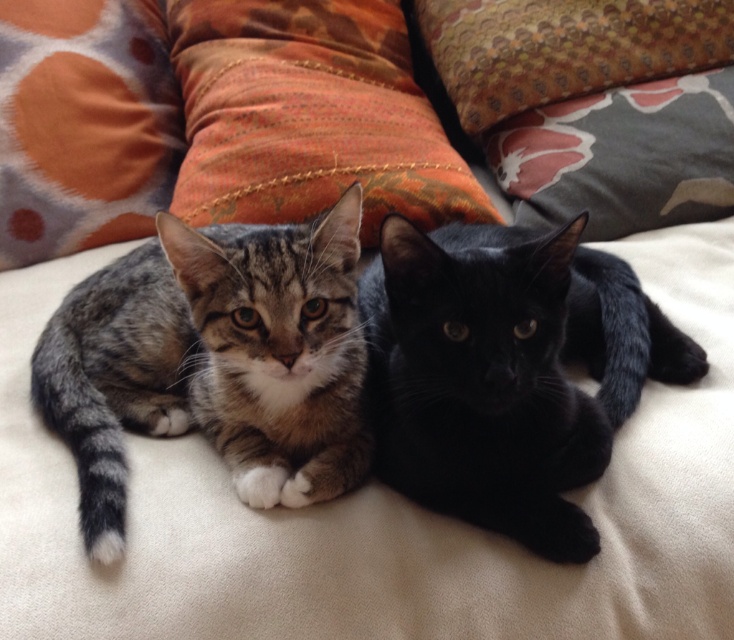
Question: Is the position of gray fabric pillow at upper right more distant than that of textured fabric pillow at upper center?

Choices:
 (A) no
 (B) yes

Answer: (A)

Question: Which of these objects is positioned farthest from the gray fabric pillow at upper right?

Choices:
 (A) orange fabric pillow at upper left
 (B) tabby fur cat at left
 (C) textured fabric pillow at upper center

Answer: (A)

Question: Can you confirm if textured orange pillow at center is smaller than orange fabric pillow at upper left?

Choices:
 (A) yes
 (B) no

Answer: (B)

Question: Which point appears closest to the camera in this image?

Choices:
 (A) (407, 449)
 (B) (26, 241)

Answer: (A)

Question: Is black glossy cat at center positioned before gray fabric pillow at upper right?

Choices:
 (A) yes
 (B) no

Answer: (A)

Question: Which object appears farthest from the camera in this image?

Choices:
 (A) orange fabric pillow at upper left
 (B) tabby fur cat at left
 (C) gray fabric pillow at upper right

Answer: (C)